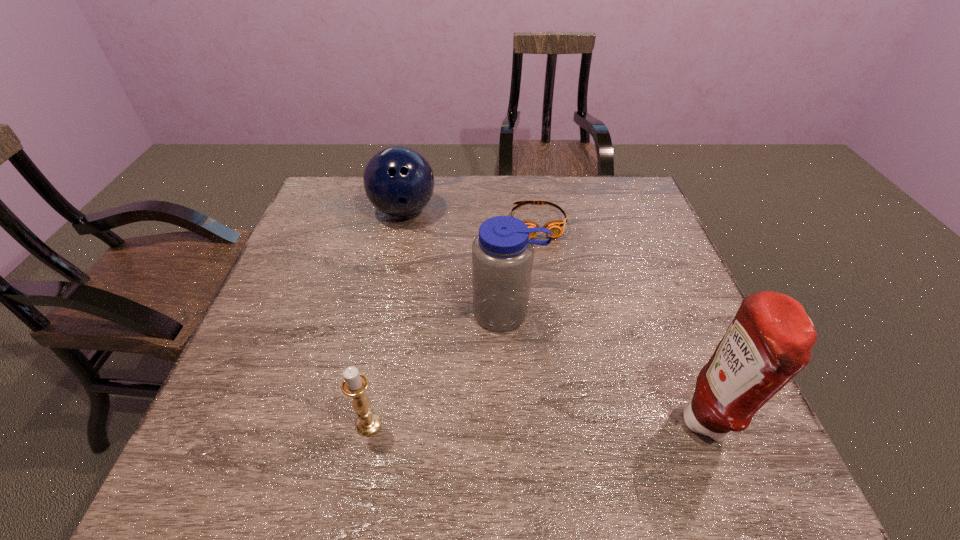
Identify the location of candle holder positioned at the near edge. (354, 384).

This screenshot has height=540, width=960. I want to click on condiment that is at the near edge, so click(769, 341).

The image size is (960, 540). I want to click on object positioned at the right edge, so click(x=769, y=341).

Locate an element on the screen. Image resolution: width=960 pixels, height=540 pixels. object located in the near right corner section of the desktop is located at coordinates (769, 341).

Locate an element on the screen. The image size is (960, 540). vacant position at the far edge of the desktop is located at coordinates (478, 193).

Locate an element on the screen. The height and width of the screenshot is (540, 960). vacant space at the near edge of the desktop is located at coordinates (403, 400).

Where is `free space at the left edge of the desktop`? free space at the left edge of the desktop is located at coordinates (x=322, y=282).

In the image, there is a desktop. Where is `vacant space at the right edge`? The height and width of the screenshot is (540, 960). vacant space at the right edge is located at coordinates (602, 221).

This screenshot has height=540, width=960. In order to click on vacant space at the far right corner in this screenshot , I will do `click(646, 214)`.

The width and height of the screenshot is (960, 540). Find the location of `vacant space that is in between the bowling ball and the candle holder`. vacant space that is in between the bowling ball and the candle holder is located at coordinates [x=386, y=318].